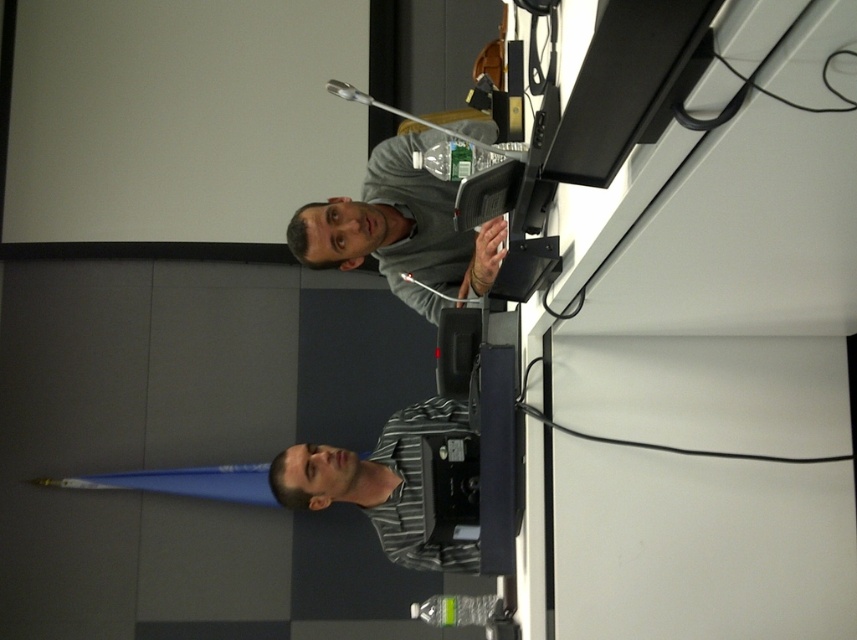
Question: Does gray matte jacket at upper center appear on the left side of striped fabric shirt at center?

Choices:
 (A) yes
 (B) no

Answer: (B)

Question: Among these points, which one is farthest from the camera?

Choices:
 (A) (470, 252)
 (B) (376, 536)

Answer: (B)

Question: Does gray matte jacket at upper center have a lesser width compared to striped fabric shirt at center?

Choices:
 (A) yes
 (B) no

Answer: (A)

Question: Which point is closer to the camera?

Choices:
 (A) striped fabric shirt at center
 (B) gray matte jacket at upper center

Answer: (B)

Question: Is gray matte jacket at upper center thinner than striped fabric shirt at center?

Choices:
 (A) no
 (B) yes

Answer: (B)